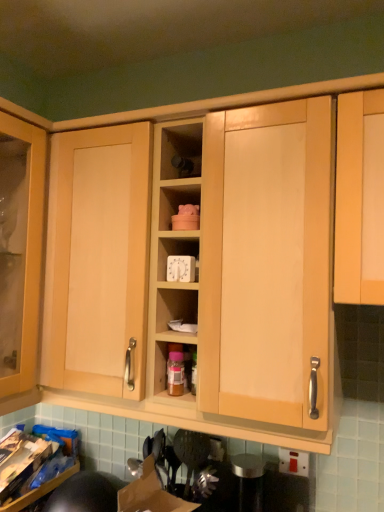
Where is `matte wood shelf at center`? matte wood shelf at center is located at coordinates (181, 151).

The height and width of the screenshot is (512, 384). I want to click on white plastic timer at center, so click(x=174, y=251).

Image resolution: width=384 pixels, height=512 pixels. What do you see at coordinates (174, 251) in the screenshot? I see `white plastic timer at center` at bounding box center [174, 251].

You are a GUI agent. You are given a task and a screenshot of the screen. Output one action in this format:
    pyautogui.click(x=<x>, y=<y>)
    Task: Click on the matte wood shelf at center
    
    Given the screenshot: What is the action you would take?
    pyautogui.click(x=181, y=151)

From the image's perspective, who appears lower, matte wood shelf at center or white plastic timer at center?

white plastic timer at center appears lower in the image.

Is the depth of matte wood shelf at center greater than that of white plastic timer at center?

No, it is not.

In the scene shown: How many degrees apart are the facing directions of matte wood shelf at center and white plastic timer at center?

matte wood shelf at center and white plastic timer at center are facing 0.00238 degrees away from each other.

Is matte wood shelf at center far away from white plastic timer at center?

That's not correct — matte wood shelf at center is a little close to white plastic timer at center.

Does matte wood shelf at center contain translucent plastic bottle at center?

No, translucent plastic bottle at center is not a part of matte wood shelf at center.

From the image's perspective, which one is positioned lower, matte wood shelf at center or translucent plastic bottle at center?

translucent plastic bottle at center.

In the scene shown: How different are the orientations of matte wood shelf at center and translucent plastic bottle at center in degrees?

The facing directions of matte wood shelf at center and translucent plastic bottle at center are 0.00229 degrees apart.

The width and height of the screenshot is (384, 512). Find the location of `bottle that is behind the white plastic timer at center`. bottle that is behind the white plastic timer at center is located at coordinates (175, 373).

Which of these two, translucent plastic bottle at center or white plastic timer at center, is wider?

white plastic timer at center is wider.

Considering the positions of point (177, 355) and point (190, 241), is point (177, 355) closer or farther from the camera than point (190, 241)?

Point (177, 355).

Which object is more forward, translucent plastic bottle at center or white plastic timer at center?

white plastic timer at center is closer to the camera.

From a real-world perspective, is translucent plastic bottle at center above or below matte wood shelf at center?

In terms of real-world spatial position, translucent plastic bottle at center is below matte wood shelf at center.

Are translucent plastic bottle at center and matte wood shelf at center beside each other?

No.

Who is more distant, translucent plastic bottle at center or matte wood shelf at center?

translucent plastic bottle at center is further from the camera.

Considering the relative positions of white plastic timer at center and matte wood shelf at center in the image provided, is white plastic timer at center behind matte wood shelf at center?

That is True.

Does white plastic timer at center appear on the right side of matte wood shelf at center?

No, white plastic timer at center is not to the right of matte wood shelf at center.

Does white plastic timer at center turn towards matte wood shelf at center?

No, white plastic timer at center does not turn towards matte wood shelf at center.

Locate an element on the screen. shelf that is in front of the white plastic timer at center is located at coordinates 181,151.

Does white plastic timer at center appear on the right side of translucent plastic bottle at center?

Correct, you'll find white plastic timer at center to the right of translucent plastic bottle at center.

How much distance is there between white plastic timer at center and translucent plastic bottle at center?

10.70 inches.

Is white plastic timer at center facing towards translucent plastic bottle at center?

No, white plastic timer at center is not turned towards translucent plastic bottle at center.

Identify the location of bottle below the white plastic timer at center (from the image's perspective). This screenshot has height=512, width=384. (175, 373).

This screenshot has width=384, height=512. Find the location of `shelf lying in front of the white plastic timer at center`. shelf lying in front of the white plastic timer at center is located at coordinates (181, 151).

Find the location of a particular element. The image size is (384, 512). shelf above the translucent plastic bottle at center (from the image's perspective) is located at coordinates (181, 151).

From the image, which object appears to be nearer to translucent plastic bottle at center, matte wood shelf at center or white plastic timer at center?

white plastic timer at center lies closer to translucent plastic bottle at center than the other object.

Based on their spatial positions, is translucent plastic bottle at center or white plastic timer at center further from matte wood shelf at center?

translucent plastic bottle at center lies further to matte wood shelf at center than the other object.

Which object lies further to the anchor point white plastic timer at center, matte wood shelf at center or translucent plastic bottle at center?

translucent plastic bottle at center.

Which object lies further to the anchor point translucent plastic bottle at center, white plastic timer at center or matte wood shelf at center?

matte wood shelf at center lies further to translucent plastic bottle at center than the other object.

Based on their spatial positions, is translucent plastic bottle at center or matte wood shelf at center closer to white plastic timer at center?

Based on the image, matte wood shelf at center appears to be nearer to white plastic timer at center.

Looking at the image, which one is located further to matte wood shelf at center, white plastic timer at center or translucent plastic bottle at center?

translucent plastic bottle at center lies further to matte wood shelf at center than the other object.

Identify the location of cabinet between matte wood shelf at center and translucent plastic bottle at center from top to bottom. coord(174,251).